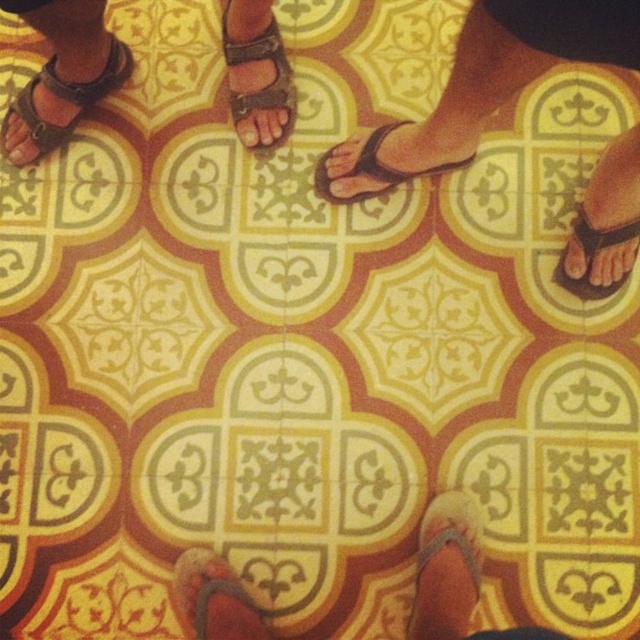
Does point (632, 234) come farther from viewer compared to point (467, 570)?

Yes.

Between black rubber sandals at center and brown suede sandal at lower center, which one appears on the right side from the viewer's perspective?

black rubber sandals at center is more to the right.

Is point (509, 19) positioned before point (461, 582)?

Yes.

Where is `black rubber sandals at center`? This screenshot has width=640, height=640. black rubber sandals at center is located at coordinates (436, 115).

What do you see at coordinates (445, 568) in the screenshot? I see `brown suede sandal at lower center` at bounding box center [445, 568].

Can you confirm if brown suede sandal at lower center is bigger than brown leather sandal at center?

No, brown suede sandal at lower center is not bigger than brown leather sandal at center.

Who is more forward, (x=422, y=602) or (x=269, y=83)?

Point (x=422, y=602)

The image size is (640, 640). Find the location of `brown suede sandal at lower center`. brown suede sandal at lower center is located at coordinates (445, 568).

Does black rubber sandals at center appear on the left side of matte brown sandal at upper left?

Incorrect, black rubber sandals at center is not on the left side of matte brown sandal at upper left.

Is the position of black rubber sandals at center less distant than that of matte brown sandal at upper left?

Yes, it is.

Describe the element at coordinates (436, 115) in the screenshot. I see `black rubber sandals at center` at that location.

At what (x,y) coordinates should I click in order to perform the action: click on black rubber sandals at center. Please return your answer as a coordinate pair (x, y). The width and height of the screenshot is (640, 640). Looking at the image, I should click on (436, 115).